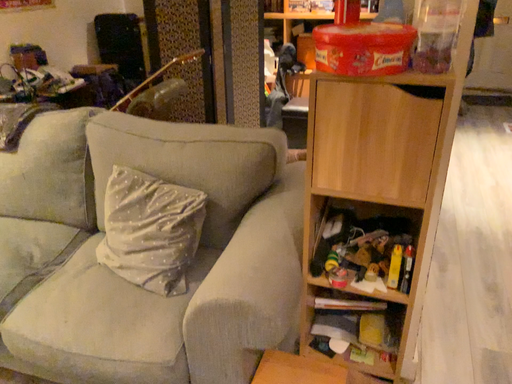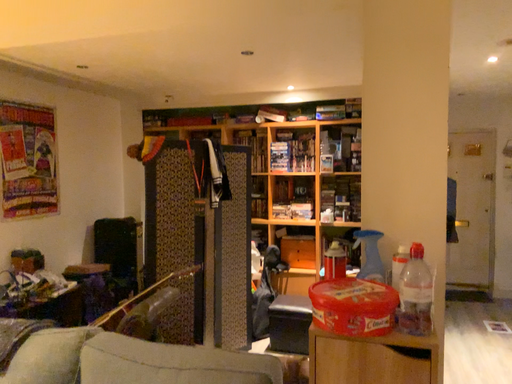
Question: How did the camera likely rotate when shooting the video?

Choices:
 (A) rotated downward
 (B) rotated upward

Answer: (B)